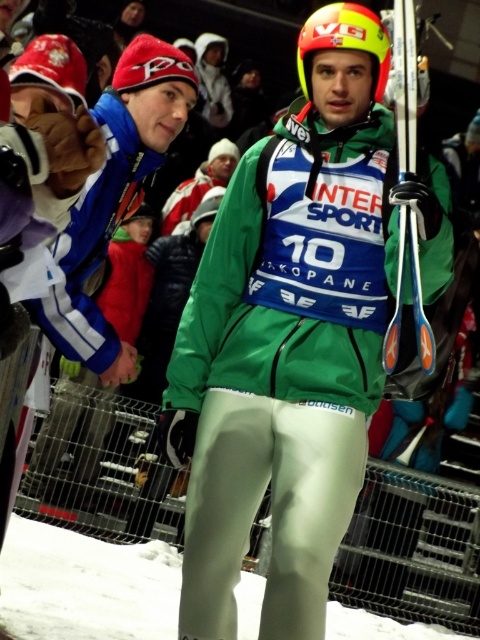
You are a photographer at the ski event. You want to take a photo of the two points in the image. The first point is labeled as point (58, 557) and the second point is labeled as point (410, 269). From your current position, which point is closer to you?

Point (410, 269) is closer to you because it is in front of point (58, 557).

From the picture: You are a photographer at the ski event. You need to capture a photo of the skier where both the shiny metallic ski at center and the yellow matte helmet at center are clearly visible. Based on their positions, will the helmet block the view of the ski in the photo?

The shiny metallic ski at center is positioned under the yellow matte helmet at center, so the helmet will block the view of the ski in the photo.